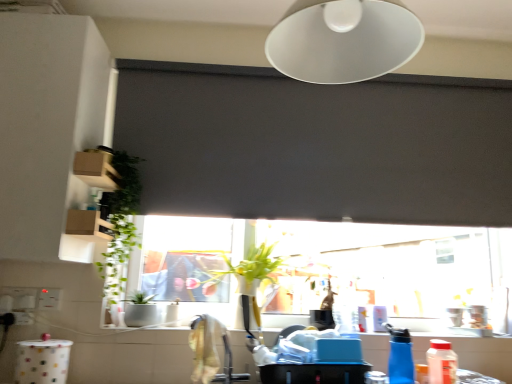
Question: Is white plastic electric outlet at lower left wider than blue plastic bottle at lower right, positioned as the second bottle in right-to-left order?

Choices:
 (A) yes
 (B) no

Answer: (B)

Question: Is white plastic electric outlet at lower left looking in the opposite direction of blue plastic bottle at lower right, arranged as the 1th bottle when viewed from the left?

Choices:
 (A) yes
 (B) no

Answer: (B)

Question: Considering the relative sizes of white plastic electric outlet at lower left and blue plastic bottle at lower right, positioned as the second bottle in right-to-left order, in the image provided, is white plastic electric outlet at lower left thinner than blue plastic bottle at lower right, positioned as the second bottle in right-to-left order,?

Choices:
 (A) no
 (B) yes

Answer: (B)

Question: From the image's perspective, is white plastic electric outlet at lower left below blue plastic bottle at lower right, arranged as the 1th bottle when viewed from the left?

Choices:
 (A) no
 (B) yes

Answer: (A)

Question: Is white plastic electric outlet at lower left placed right next to blue plastic bottle at lower right, positioned as the second bottle in right-to-left order?

Choices:
 (A) no
 (B) yes

Answer: (A)

Question: From a real-world perspective, is translucent plastic bottle at lower right, which is the second bottle from left to right, physically located above or below white ceramic sink at window?

Choices:
 (A) above
 (B) below

Answer: (B)

Question: From the image's perspective, relative to white ceramic sink at window, is translucent plastic bottle at lower right, the 1th bottle viewed from the right, above or below?

Choices:
 (A) above
 (B) below

Answer: (B)

Question: Is translucent plastic bottle at lower right, which is the second bottle from left to right, taller or shorter than white ceramic sink at window?

Choices:
 (A) tall
 (B) short

Answer: (A)

Question: Would you say translucent plastic bottle at lower right, the 1th bottle viewed from the right, is to the left or to the right of white ceramic sink at window in the picture?

Choices:
 (A) right
 (B) left

Answer: (A)

Question: Considering the positions of translucent plastic bottle at lower right, the 1th bottle viewed from the right, and transparent glass window at center in the image, is translucent plastic bottle at lower right, the 1th bottle viewed from the right, taller or shorter than transparent glass window at center?

Choices:
 (A) short
 (B) tall

Answer: (A)

Question: In terms of width, does translucent plastic bottle at lower right, the 1th bottle viewed from the right, look wider or thinner when compared to transparent glass window at center?

Choices:
 (A) thin
 (B) wide

Answer: (B)

Question: Considering the positions of point (438, 362) and point (384, 253), is point (438, 362) closer or farther from the camera than point (384, 253)?

Choices:
 (A) closer
 (B) farther

Answer: (A)

Question: Is translucent plastic bottle at lower right, which is the second bottle from left to right, in front of or behind transparent glass window at center in the image?

Choices:
 (A) behind
 (B) front

Answer: (B)

Question: Looking at the image, does white ceramic sink at window seem bigger or smaller compared to translucent plastic bottle at lower right, the 1th bottle viewed from the right?

Choices:
 (A) big
 (B) small

Answer: (A)

Question: In terms of width, does white ceramic sink at window look wider or thinner when compared to translucent plastic bottle at lower right, the 1th bottle viewed from the right?

Choices:
 (A) thin
 (B) wide

Answer: (B)